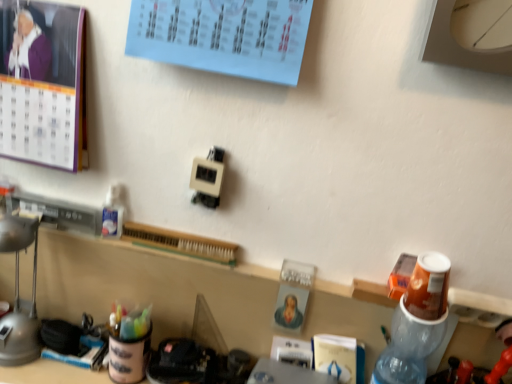
Question: Is matte gray lamp at left behind purple paper calendar at upper left?

Choices:
 (A) yes
 (B) no

Answer: (A)

Question: Considering the relative positions of matte gray lamp at left and purple paper calendar at upper left in the image provided, is matte gray lamp at left to the left of purple paper calendar at upper left from the viewer's perspective?

Choices:
 (A) yes
 (B) no

Answer: (A)

Question: Is matte gray lamp at left smaller than purple paper calendar at upper left?

Choices:
 (A) yes
 (B) no

Answer: (A)

Question: From a real-world perspective, is matte gray lamp at left under purple paper calendar at upper left?

Choices:
 (A) yes
 (B) no

Answer: (A)

Question: From the image's perspective, is matte gray lamp at left beneath purple paper calendar at upper left?

Choices:
 (A) yes
 (B) no

Answer: (A)

Question: From the image's perspective, is matte gray lamp at left on purple paper calendar at upper left?

Choices:
 (A) yes
 (B) no

Answer: (B)

Question: Is translucent plastic bottle at right closer to camera compared to matte gray lamp at left?

Choices:
 (A) yes
 (B) no

Answer: (A)

Question: Is translucent plastic bottle at right bigger than matte gray lamp at left?

Choices:
 (A) yes
 (B) no

Answer: (A)

Question: Is translucent plastic bottle at right oriented away from matte gray lamp at left?

Choices:
 (A) no
 (B) yes

Answer: (A)

Question: Is matte gray lamp at left located within translucent plastic bottle at right?

Choices:
 (A) yes
 (B) no

Answer: (B)

Question: Is translucent plastic bottle at right far from matte gray lamp at left?

Choices:
 (A) yes
 (B) no

Answer: (B)

Question: Is translucent plastic bottle at right taller than matte gray lamp at left?

Choices:
 (A) no
 (B) yes

Answer: (B)

Question: From a real-world perspective, is translucent plastic bottle at right located beneath purple paper calendar at upper left?

Choices:
 (A) yes
 (B) no

Answer: (A)